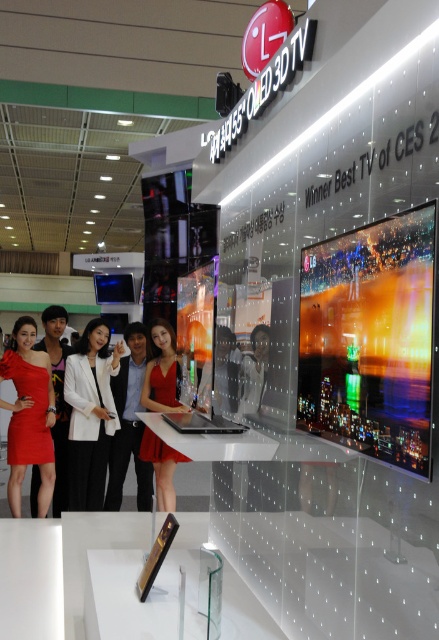
Question: Among these points, which one is nearest to the camera?

Choices:
 (A) (20, 435)
 (B) (86, 488)
 (C) (151, 449)

Answer: (A)

Question: Estimate the real-world distances between objects in this image. Which object is closer to the white matte blazer at center?

Choices:
 (A) matte red dress at lower left
 (B) red satin dress at center

Answer: (A)

Question: Can you confirm if white matte blazer at center is positioned to the left of red satin dress at center?

Choices:
 (A) yes
 (B) no

Answer: (A)

Question: Does white matte blazer at center have a lesser width compared to matte red dress at lower left?

Choices:
 (A) no
 (B) yes

Answer: (A)

Question: In this image, where is matte red dress at lower left located relative to red satin dress at center?

Choices:
 (A) left
 (B) right

Answer: (A)

Question: Which object is the closest to the red satin dress at center?

Choices:
 (A) matte red dress at lower left
 (B) white matte blazer at center

Answer: (B)